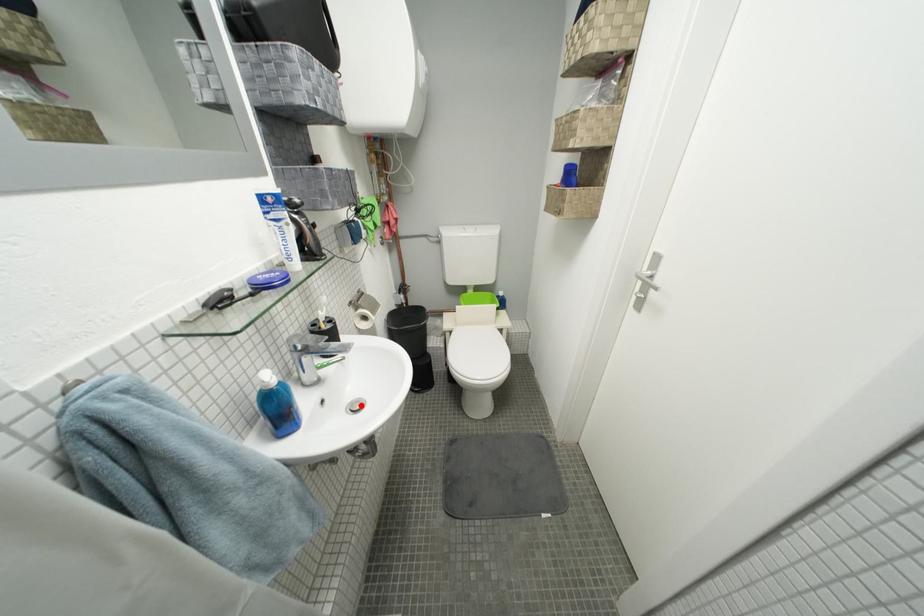
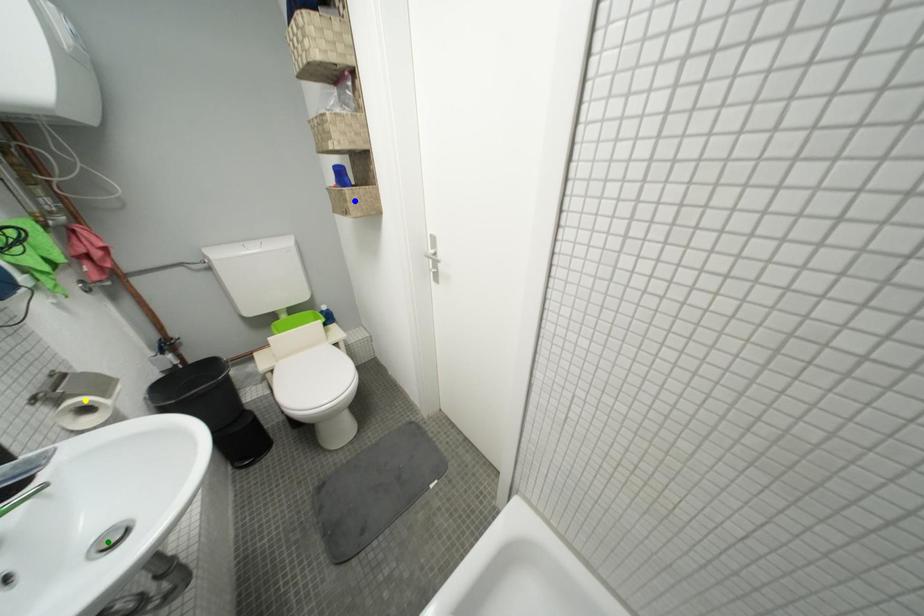
Question: I am providing you with two images of the same scene from different viewpoints. A red point is marked on the first image. You are given multiple points on the second image. Which point in image 2 is actually the same real-world point as the red point in image 1?

Choices:
 (A) blue point
 (B) yellow point
 (C) green point

Answer: (C)